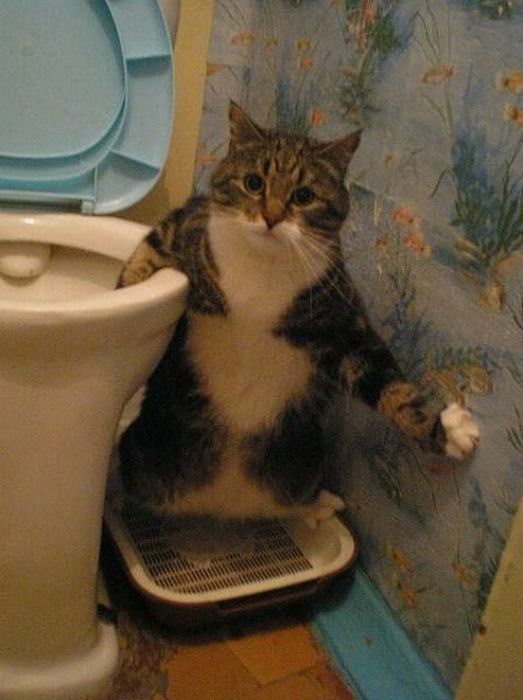
Locate an element on the screen. The image size is (523, 700). rim of toilet is located at coordinates (126, 306).